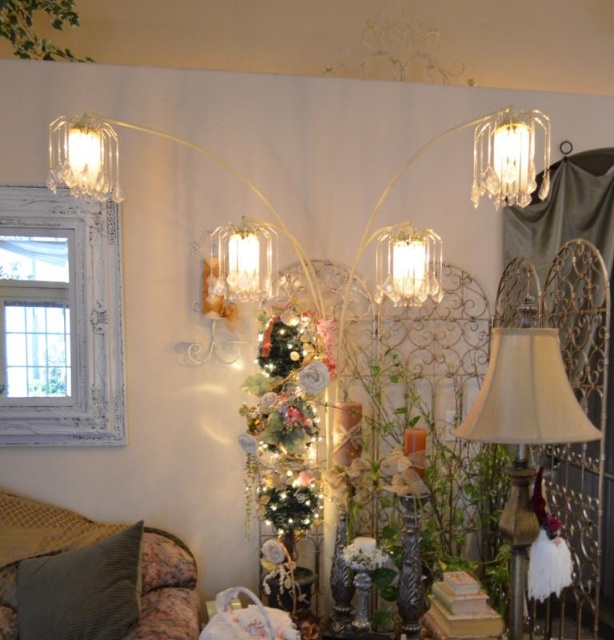
Question: Does beige fabric lampshade at right have a smaller size compared to green corduroy pillow at lower left?

Choices:
 (A) yes
 (B) no

Answer: (B)

Question: Estimate the real-world distances between objects in this image. Which object is farther from the clear crystal chandelier at center?

Choices:
 (A) green corduroy pillow at lower left
 (B) shiny metallic tree at center
 (C) beige fabric lampshade at right

Answer: (A)

Question: Estimate the real-world distances between objects in this image. Which object is farther from the clear crystal chandelier at center?

Choices:
 (A) shiny metallic tree at center
 (B) clear glass lampshade at upper left
 (C) beige fabric lampshade at right

Answer: (C)

Question: Can you confirm if beige fabric lampshade at right is smaller than clear crystal chandelier at upper right?

Choices:
 (A) yes
 (B) no

Answer: (A)

Question: In this image, where is shiny metallic tree at center located relative to green corduroy pillow at lower left?

Choices:
 (A) right
 (B) left

Answer: (A)

Question: Which of the following is the closest to the observer?

Choices:
 (A) (90, 138)
 (B) (518, 497)
 (C) (413, 250)
 (D) (518, 113)

Answer: (B)